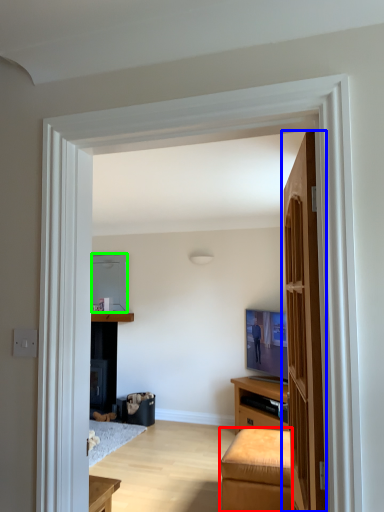
Question: Based on their relative distances, which object is farther from furniture (highlighted by a red box)? Choose from door (highlighted by a blue box) and appliance (highlighted by a green box).

Choices:
 (A) door
 (B) appliance

Answer: (B)